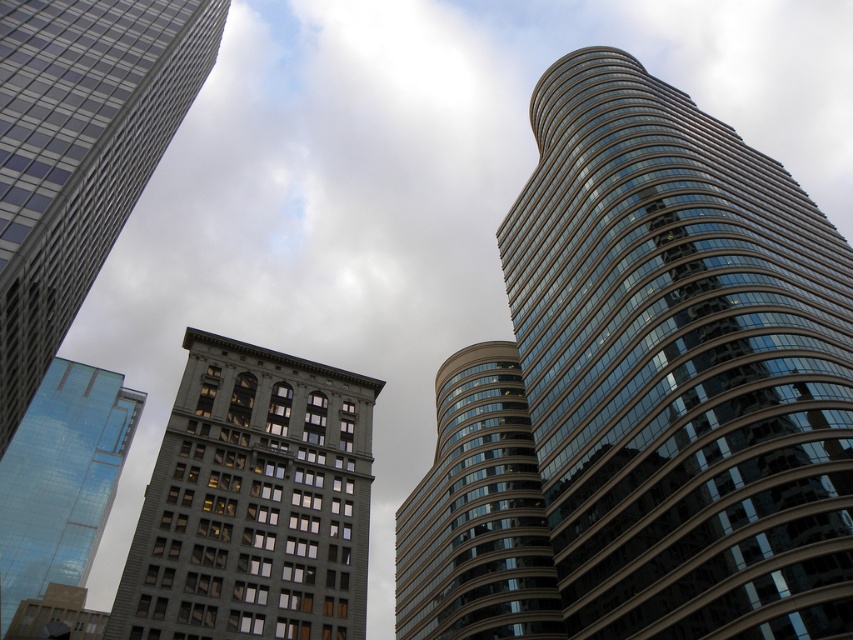
Question: Is matte glass skyscraper at center to the right of brown stone tower at lower left from the viewer's perspective?

Choices:
 (A) no
 (B) yes

Answer: (B)

Question: Is glassy reflective building at right to the left of glassy reflective skyscraper at left from the viewer's perspective?

Choices:
 (A) yes
 (B) no

Answer: (B)

Question: Is glassy reflective skyscraper at left wider than brown stone tower at lower left?

Choices:
 (A) no
 (B) yes

Answer: (B)

Question: Based on their relative distances, which object is farther from the glassy reflective building at right?

Choices:
 (A) matte glass skyscraper at center
 (B) brown stone tower at lower left
 (C) gray stone building at center

Answer: (B)

Question: Which of the following is the closest to the observer?

Choices:
 (A) gray stone building at center
 (B) matte glass skyscraper at center
 (C) glassy reflective skyscraper at left

Answer: (B)

Question: Among these points, which one is nearest to the camera?

Choices:
 (A) (62, 637)
 (B) (99, 508)
 (C) (671, 294)
 (D) (93, 192)

Answer: (D)